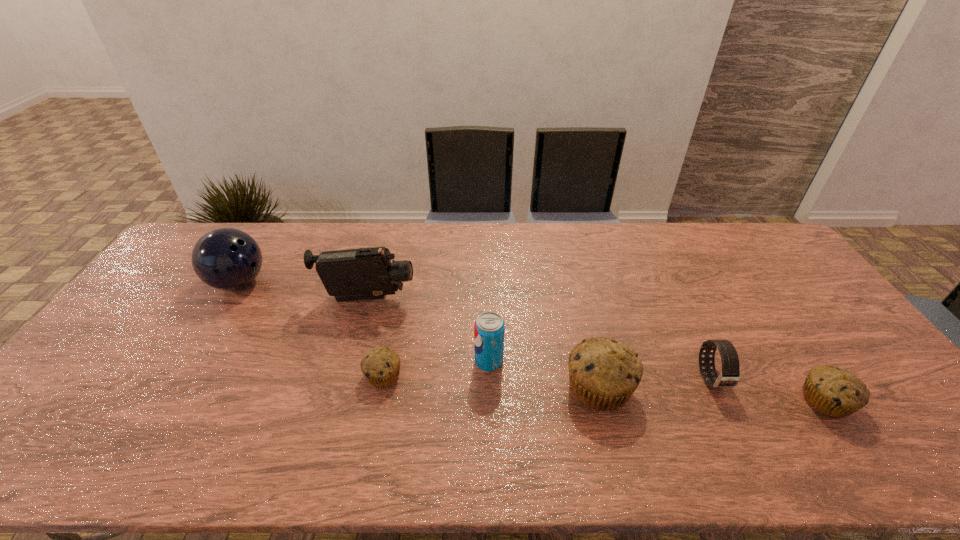
This screenshot has height=540, width=960. In order to click on free point between the watch and the shortest object in this screenshot , I will do `click(547, 377)`.

At what (x,y) coordinates should I click in order to perform the action: click on free spot between the camcorder and the leftmost object. Please return your answer as a coordinate pair (x, y). The height and width of the screenshot is (540, 960). Looking at the image, I should click on (303, 291).

I want to click on empty space that is in between the tallest muffin and the second shortest object, so click(x=712, y=394).

The image size is (960, 540). I want to click on object that is the fifth closest to the shortest object, so click(729, 377).

At what (x,y) coordinates should I click in order to perform the action: click on object identified as the third closest to the camcorder. Please return your answer as a coordinate pair (x, y). Looking at the image, I should click on (489, 328).

This screenshot has height=540, width=960. What are the coordinates of `muffin that is the closest one to the camcorder` in the screenshot? It's located at click(381, 366).

Select which muffin appears as the closest to the second object from right to left. Please provide its 2D coordinates. Your answer should be formatted as a tuple, i.e. [(x, y)], where the tuple contains the x and y coordinates of a point satisfying the conditions above.

[(835, 392)]

At what (x,y) coordinates should I click in order to perform the action: click on free space that satisfies the following two spatial constraints: 1. on the back side of the fourth object from left to right; 2. on the surface of the leftmost object near the finger holes. Please return your answer as a coordinate pair (x, y). Looking at the image, I should click on (488, 282).

In order to click on vacant position in the image that satisfies the following two spatial constraints: 1. on the front-facing side of the second shortest object; 2. on the left side of the camcorder in this screenshot , I will do `click(339, 401)`.

This screenshot has width=960, height=540. What are the coordinates of `free space that satisfies the following two spatial constraints: 1. on the surface of the bowling ball near the finger holes; 2. on the right side of the rightmost muffin` in the screenshot? It's located at (166, 401).